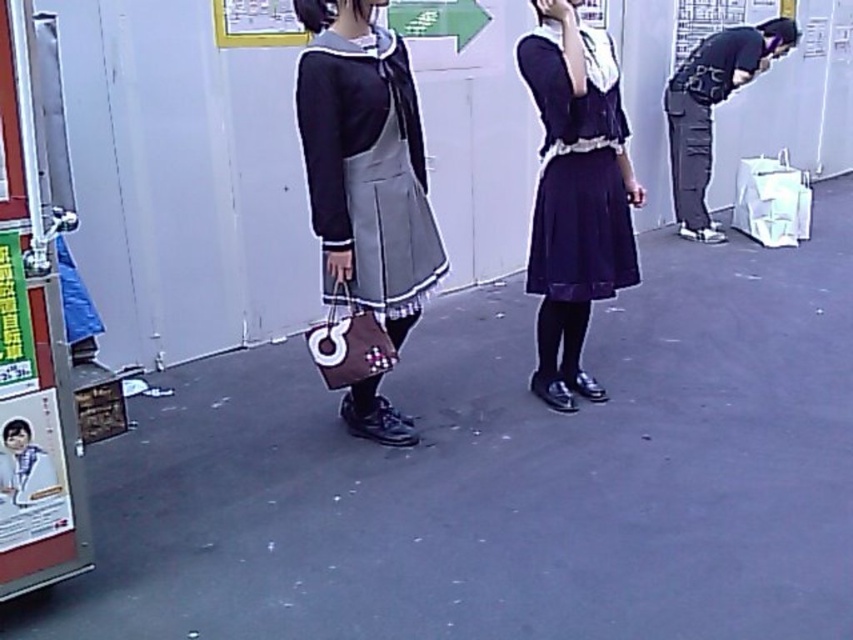
You are a fashion designer observing two pairs of dark gray pants in the image. The first pair is labeled as dark gray pants at right, and the second is dark gray fabric pants at right. Based on the scene description, which pair is wider?

The dark gray pants at right are wider than the dark gray fabric pants at right.